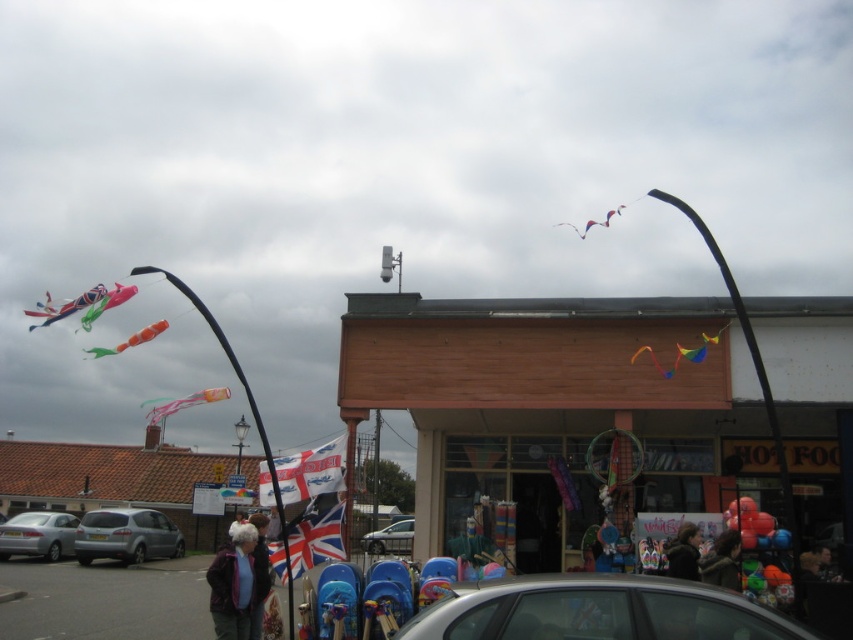
Who is lower down, silver metallic hatchback at lower left or silver metallic car at center?

Positioned lower is silver metallic car at center.

Is silver metallic hatchback at lower left smaller than silver metallic car at center?

No, silver metallic hatchback at lower left is not smaller than silver metallic car at center.

Does point (90, 518) lie behind point (405, 541)?

That is False.

The width and height of the screenshot is (853, 640). Identify the location of silver metallic hatchback at lower left. (126, 536).

Which of these two, dark brown hair at center or silver metallic car at center, stands shorter?

With less height is dark brown hair at center.

Can you confirm if dark brown hair at center is shorter than silver metallic car at center?

Indeed, dark brown hair at center has a lesser height compared to silver metallic car at center.

Who is more distant from viewer, (674, 545) or (403, 522)?

The point (403, 522) is behind.

This screenshot has width=853, height=640. I want to click on dark brown hair at center, so click(683, 552).

Does metallic kite at left appear under translucent plastic kite at center?

Incorrect, metallic kite at left is not positioned below translucent plastic kite at center.

In the scene shown: Does metallic kite at left have a greater height compared to translucent plastic kite at center?

Correct, metallic kite at left is much taller as translucent plastic kite at center.

Is point (196, 301) less distant than point (171, 403)?

No, it is behind (171, 403).

Locate an element on the screen. The image size is (853, 640). metallic kite at left is located at coordinates (233, 369).